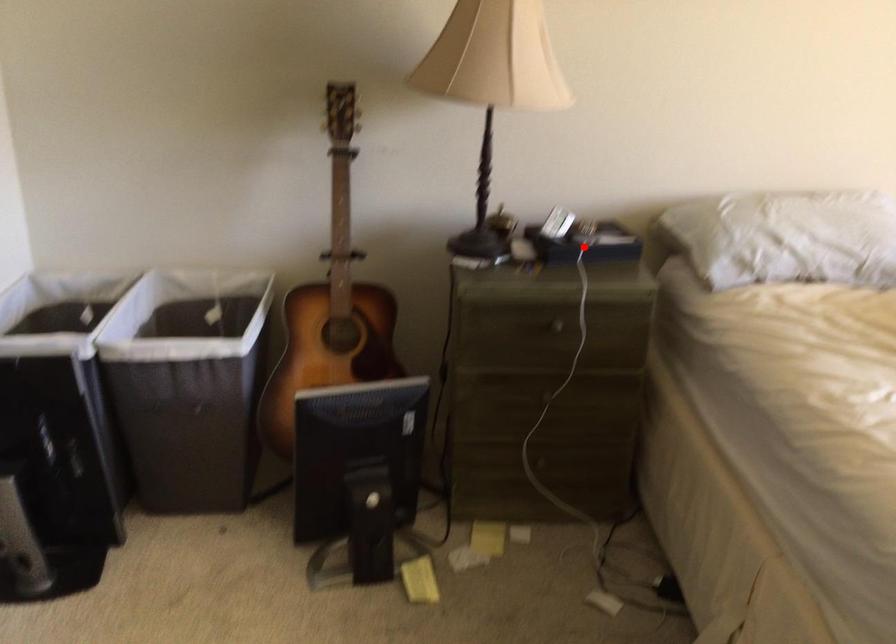
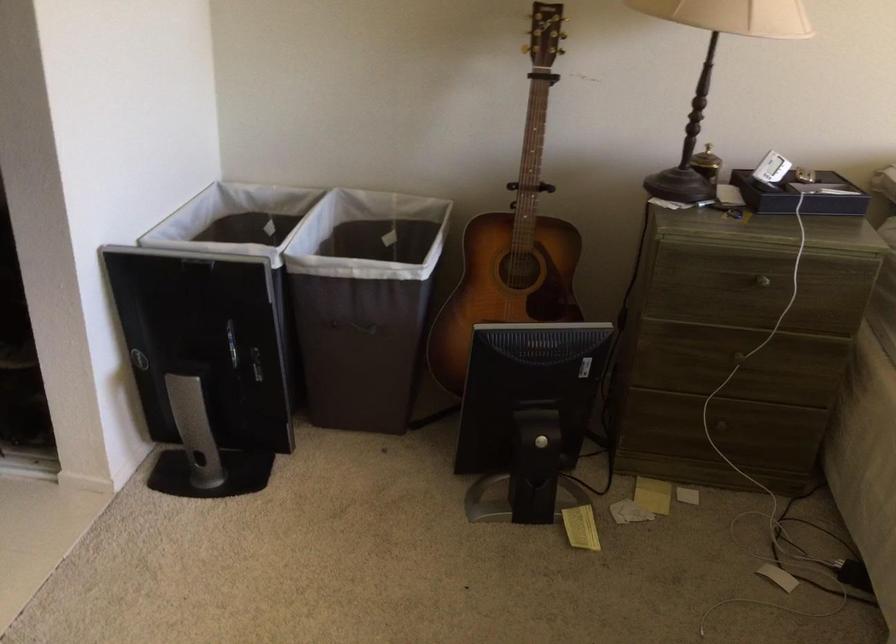
Find the pixel in the second image that matches the highlighted location in the first image.

(800, 194)